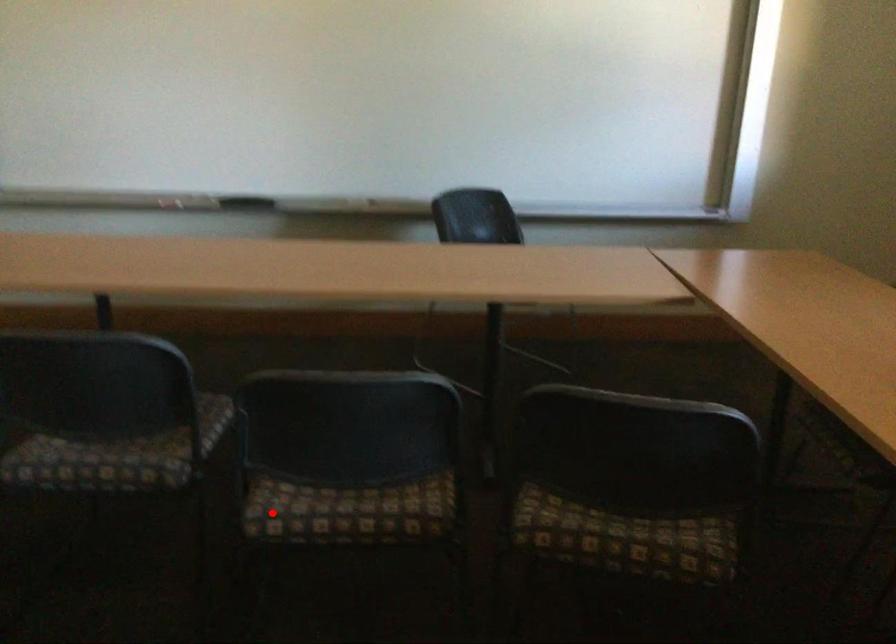
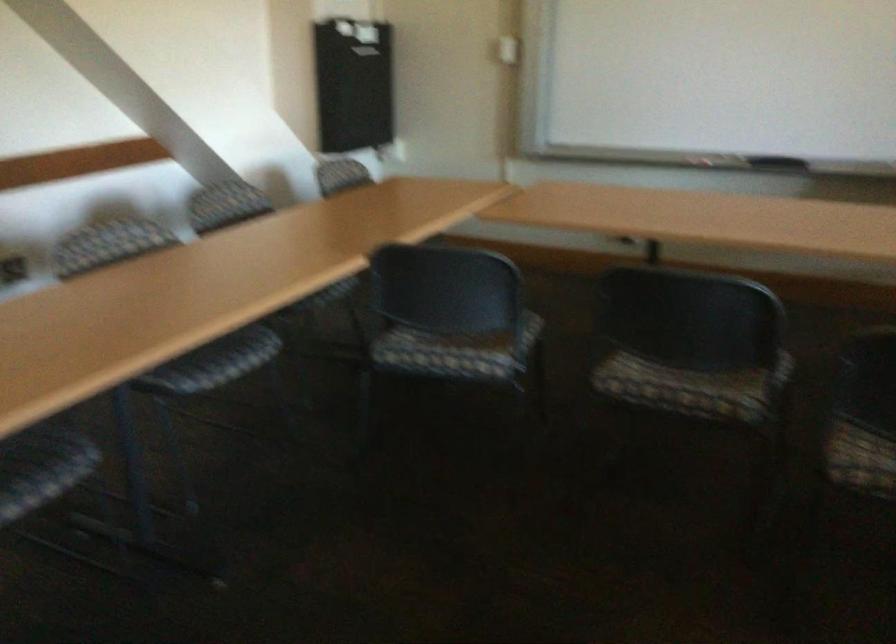
Question: I am providing you with two images of the same scene from different viewpoints. A red point is marked on the first image. At the location where the point appears in image 1, is it still visible in image 2?

Choices:
 (A) Yes
 (B) No

Answer: (A)